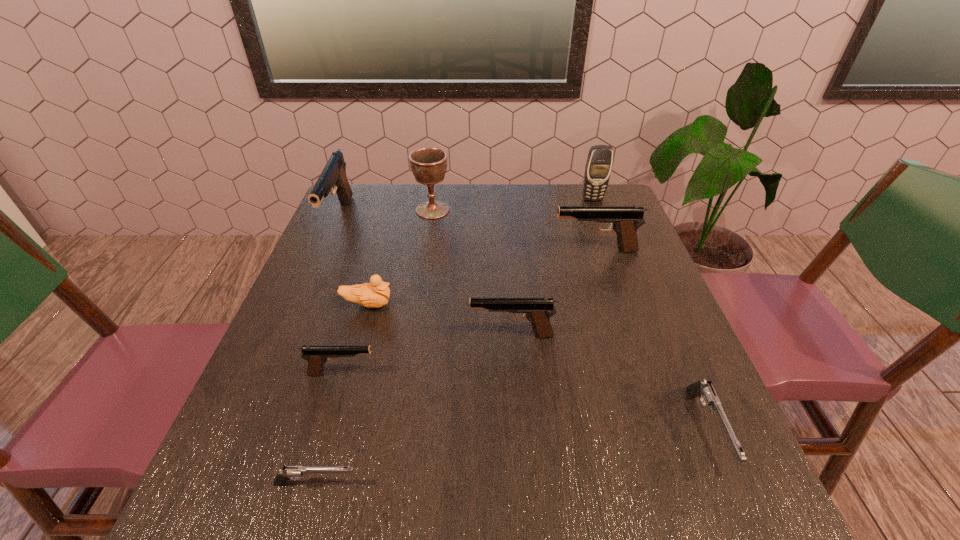
Where is `chalice`? chalice is located at coordinates (429, 164).

You are a GUI agent. You are given a task and a screenshot of the screen. Output one action in this format:
    pyautogui.click(x=<x>, y=<y>)
    Task: Click on the cellular telephone
    Image resolution: width=960 pixels, height=540 pixels.
    Given the screenshot: What is the action you would take?
    pyautogui.click(x=598, y=167)

Find the location of a particular element. This screenshot has width=960, height=540. the leftmost pistol is located at coordinates (333, 175).

You are a GUI agent. You are given a task and a screenshot of the screen. Output one action in this format:
    pyautogui.click(x=<x>, y=<y>)
    Task: Click on the leftmost object
    
    Given the screenshot: What is the action you would take?
    pyautogui.click(x=333, y=175)

What are the coordinates of `the fifth shortest pistol` in the screenshot? It's located at (625, 220).

This screenshot has width=960, height=540. What are the coordinates of `the second biggest black pistol` in the screenshot? It's located at (625, 220).

You are a GUI agent. You are given a task and a screenshot of the screen. Output one action in this format:
    pyautogui.click(x=<x>, y=<y>)
    Task: Click on the second black pistol from right to left
    The image size is (960, 540).
    Given the screenshot: What is the action you would take?
    (537, 310)

Find the location of a particular element. the sixth object from left to right is located at coordinates (537, 310).

Image resolution: width=960 pixels, height=540 pixels. Identify the location of duckling. (375, 294).

This screenshot has width=960, height=540. Identify the location of the smallest black pistol. (316, 355).